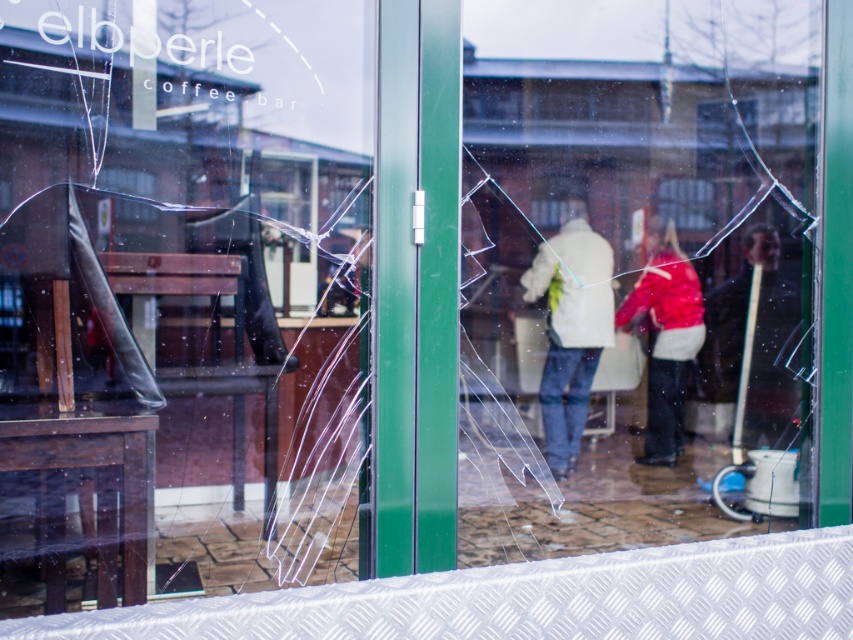
You are a delivery person trying to enter the store through the transparent glass shop window at center. The dark brown leather jacket at right is blocking your view. Can you see the entrance clearly?

The transparent glass shop window at center is located below the dark brown leather jacket at right, so the jacket is blocking part of the window. You cannot see the entrance clearly through the transparent glass shop window at center.

You are standing outside the broken storefront door and want to know which of the two points, point (727, 529) or point (654, 244), is closer to you. Can you determine this based on the scene?

Point (727, 529) is closer to the camera than point (654, 244), so it is closer to you.